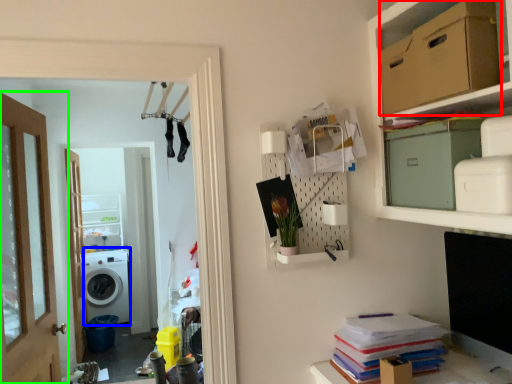
Question: Which is farther away from cardboard box (highlighted by a red box)? washing machine (highlighted by a blue box) or door (highlighted by a green box)?

Choices:
 (A) washing machine
 (B) door

Answer: (A)